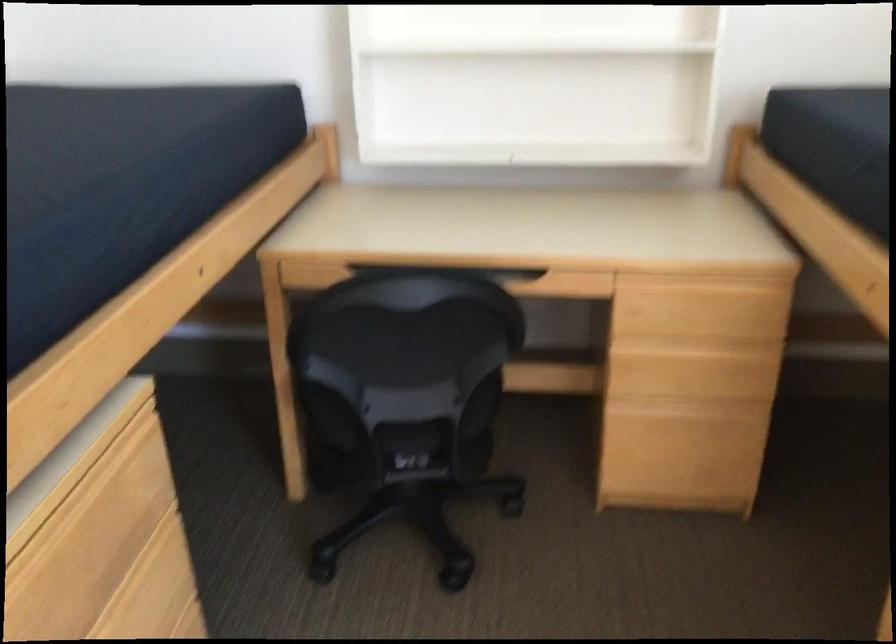
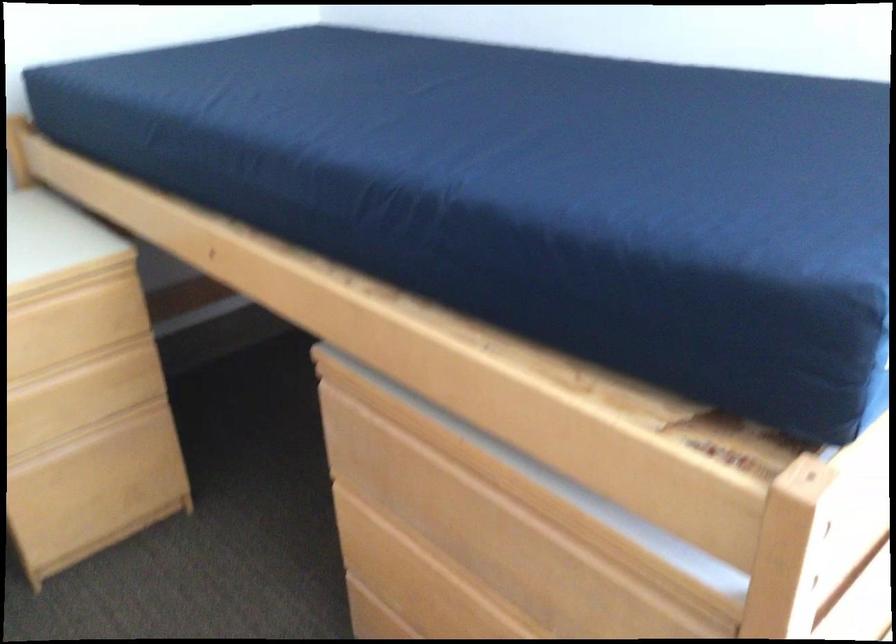
Locate, in the second image, the point that corresponds to the point at 668,460 in the first image.

(97, 495)